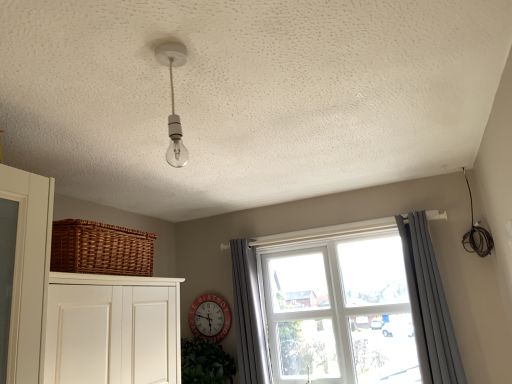
Looking at this image, what is the approximate width of gray fabric curtain at right, the 2th curtain positioned from the left?

gray fabric curtain at right, the 2th curtain positioned from the left, is 7.11 inches in width.

At what (x,y) coordinates should I click in order to perform the action: click on clear glass window at center. Please return your answer as a coordinate pair (x, y). Looking at the image, I should click on (344, 307).

Considering the relative sizes of gray fabric curtain at right, the 2th curtain positioned from the left, and red metallic clock at center in the image provided, is gray fabric curtain at right, the 2th curtain positioned from the left, taller than red metallic clock at center?

Yes, gray fabric curtain at right, the 2th curtain positioned from the left, is taller than red metallic clock at center.

Which object is closer to the camera taking this photo, gray fabric curtain at right, the first curtain from the right, or red metallic clock at center?

gray fabric curtain at right, the first curtain from the right, is closer to the camera.

How different are the orientations of gray fabric curtain at right, the 2th curtain positioned from the left, and red metallic clock at center in degrees?

The angular difference between gray fabric curtain at right, the 2th curtain positioned from the left, and red metallic clock at center is 7.76 degrees.

Which is more to the right, gray fabric curtain at right, the 2th curtain positioned from the left, or woven brown basket at left?

gray fabric curtain at right, the 2th curtain positioned from the left.

Could you measure the distance between gray fabric curtain at right, the 2th curtain positioned from the left, and woven brown basket at left?

A distance of 1.59 meters exists between gray fabric curtain at right, the 2th curtain positioned from the left, and woven brown basket at left.

Does gray fabric curtain at right, the first curtain from the right, have a greater height compared to woven brown basket at left?

Yes.

Is gray fabric curtain at right, the 2th curtain positioned from the left, positioned beyond the bounds of woven brown basket at left?

That's correct, gray fabric curtain at right, the 2th curtain positioned from the left, is outside of woven brown basket at left.

Considering the sizes of objects red metallic clock at center and clear glass bulb at center in the image provided, who is wider, red metallic clock at center or clear glass bulb at center?

clear glass bulb at center.

Is red metallic clock at center closer to camera compared to clear glass bulb at center?

No.

Is point (218, 319) positioned in front of point (176, 126)?

No, (218, 319) is further to viewer.

From a real-world perspective, between red metallic clock at center and clear glass bulb at center, who is vertically higher?

In real-world perspective, clear glass bulb at center is above.

How different are the orientations of gray fabric curtain at window, acting as the second curtain starting from the right, and gray fabric curtain at right, the first curtain from the right, in degrees?

0.745 degrees.

Considering the positions of objects gray fabric curtain at window, the first curtain from the left, and gray fabric curtain at right, the 2th curtain positioned from the left, in the image provided, who is in front, gray fabric curtain at window, the first curtain from the left, or gray fabric curtain at right, the 2th curtain positioned from the left,?

gray fabric curtain at right, the 2th curtain positioned from the left, is more forward.

Are gray fabric curtain at window, the first curtain from the left, and gray fabric curtain at right, the first curtain from the right, far apart?

Indeed, gray fabric curtain at window, the first curtain from the left, is not near gray fabric curtain at right, the first curtain from the right.

From the picture: Is gray fabric curtain at window, acting as the second curtain starting from the right, wider or thinner than gray fabric curtain at right, the 2th curtain positioned from the left?

gray fabric curtain at window, acting as the second curtain starting from the right, is wider than gray fabric curtain at right, the 2th curtain positioned from the left.

From a real-world perspective, does gray fabric curtain at right, the first curtain from the right, stand above clear glass bulb at center?

Actually, gray fabric curtain at right, the first curtain from the right, is physically below clear glass bulb at center in the real world.

Could you tell me if gray fabric curtain at right, the first curtain from the right, is facing clear glass bulb at center?

No, gray fabric curtain at right, the first curtain from the right, does not turn towards clear glass bulb at center.

Measure the distance from gray fabric curtain at right, the 2th curtain positioned from the left, to clear glass bulb at center.

gray fabric curtain at right, the 2th curtain positioned from the left, and clear glass bulb at center are 5.81 feet apart.

Can you confirm if clear glass window at center is bigger than gray fabric curtain at right, the 2th curtain positioned from the left?

Yes, clear glass window at center is bigger than gray fabric curtain at right, the 2th curtain positioned from the left.

Is there a large distance between clear glass window at center and gray fabric curtain at right, the 2th curtain positioned from the left?

No, there isn't a large distance between clear glass window at center and gray fabric curtain at right, the 2th curtain positioned from the left.

The height and width of the screenshot is (384, 512). Find the location of `curtain above the clear glass window at center (from the image's perspective)`. curtain above the clear glass window at center (from the image's perspective) is located at coordinates (429, 305).

How many degrees apart are the facing directions of clear glass window at center and gray fabric curtain at right, the first curtain from the right?

9.02 degrees separate the facing orientations of clear glass window at center and gray fabric curtain at right, the first curtain from the right.

Could you tell me if woven brown basket at left is facing clear glass window at center?

No, woven brown basket at left is not oriented towards clear glass window at center.

Is woven brown basket at left further to camera compared to clear glass window at center?

No.

The height and width of the screenshot is (384, 512). In order to click on window that is behind the woven brown basket at left in this screenshot , I will do `click(344, 307)`.

Considering the points (75, 261) and (421, 365), which point is behind, point (75, 261) or point (421, 365)?

The point (421, 365) is behind.

There is a red metallic clock at center. Where is `the 1st curtain above it (from a real-world perspective)`? Image resolution: width=512 pixels, height=384 pixels. the 1st curtain above it (from a real-world perspective) is located at coordinates (429, 305).

Identify the location of basket above the gray fabric curtain at right, the 2th curtain positioned from the left (from the image's perspective). (101, 249).

Considering their positions, is clear glass bulb at center positioned further to clear glass window at center than red metallic clock at center?

Based on the image, clear glass bulb at center appears to be further to clear glass window at center.

Which object lies nearer to the anchor point woven brown basket at left, gray fabric curtain at window, acting as the second curtain starting from the right, or clear glass window at center?

gray fabric curtain at window, acting as the second curtain starting from the right, is positioned closer to the anchor woven brown basket at left.

When comparing their distances from clear glass bulb at center, does gray fabric curtain at right, the 2th curtain positioned from the left, or gray fabric curtain at window, acting as the second curtain starting from the right, seem further?

gray fabric curtain at right, the 2th curtain positioned from the left.

Looking at the image, which one is located closer to gray fabric curtain at right, the 2th curtain positioned from the left, woven brown basket at left or clear glass bulb at center?

woven brown basket at left.

In the scene shown: Considering their positions, is gray fabric curtain at right, the 2th curtain positioned from the left, positioned closer to woven brown basket at left than red metallic clock at center?

red metallic clock at center is positioned closer to the anchor woven brown basket at left.

Based on their spatial positions, is clear glass bulb at center or clear glass window at center further from red metallic clock at center?

clear glass bulb at center is positioned further to the anchor red metallic clock at center.

When comparing their distances from clear glass bulb at center, does woven brown basket at left or gray fabric curtain at right, the 2th curtain positioned from the left, seem closer?

woven brown basket at left is positioned closer to the anchor clear glass bulb at center.

From the image, which object appears to be farther from clear glass window at center, gray fabric curtain at right, the 2th curtain positioned from the left, or woven brown basket at left?

Among the two, woven brown basket at left is located further to clear glass window at center.

The image size is (512, 384). I want to click on curtain between red metallic clock at center and clear glass window at center in the horizontal direction, so click(249, 316).

At what (x,y) coordinates should I click in order to perform the action: click on basket located between clear glass bulb at center and clear glass window at center in the depth direction. Please return your answer as a coordinate pair (x, y). The width and height of the screenshot is (512, 384). Looking at the image, I should click on (101, 249).

Find the location of `curtain located between red metallic clock at center and gray fabric curtain at right, the first curtain from the right, in the left-right direction`. curtain located between red metallic clock at center and gray fabric curtain at right, the first curtain from the right, in the left-right direction is located at coordinates (249, 316).

The height and width of the screenshot is (384, 512). In order to click on curtain between woven brown basket at left and clear glass window at center in the horizontal direction in this screenshot , I will do `click(249, 316)`.